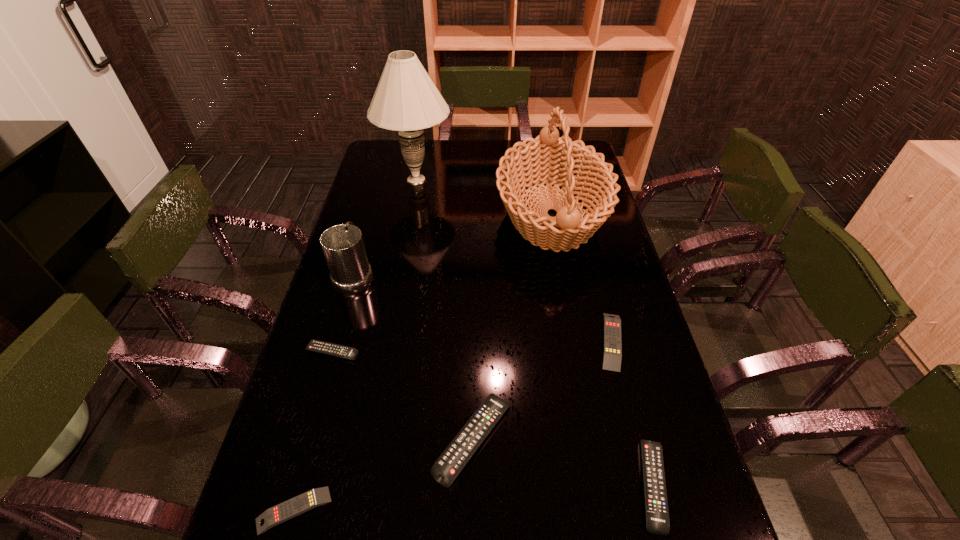
Where is `vacant position in the image that satisfies the following two spatial constraints: 1. on the front side of the bigger yellow remote control; 2. on the right side of the lampshade`? The height and width of the screenshot is (540, 960). vacant position in the image that satisfies the following two spatial constraints: 1. on the front side of the bigger yellow remote control; 2. on the right side of the lampshade is located at coordinates (387, 341).

You are a GUI agent. You are given a task and a screenshot of the screen. Output one action in this format:
    pyautogui.click(x=<x>, y=<y>)
    Task: Click on the free point that satisfies the following two spatial constraints: 1. on the front side of the bigger yellow remote control; 2. on the left side of the rightmost black remote control
    
    Given the screenshot: What is the action you would take?
    pyautogui.click(x=649, y=485)